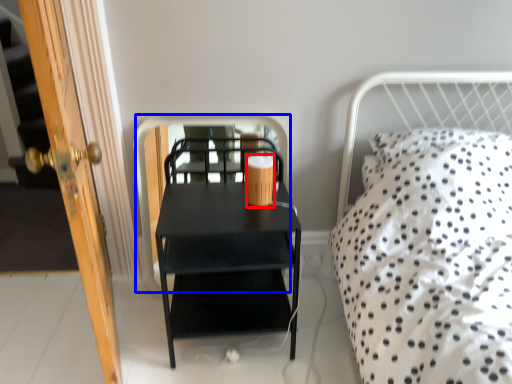
Question: Which point is closer to the camera, coffee cup (highlighted by a red box) or screen door (highlighted by a blue box)?

Choices:
 (A) coffee cup
 (B) screen door

Answer: (A)